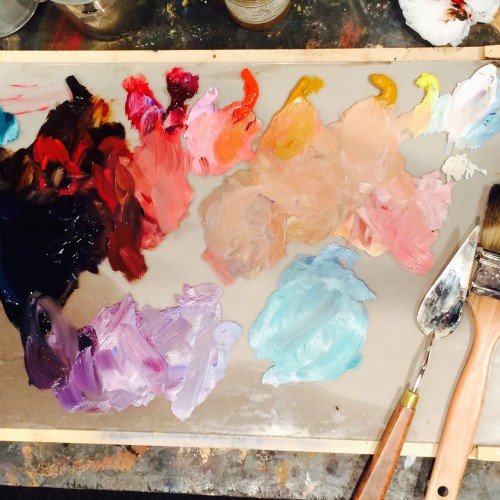
The image size is (500, 500). I want to click on blue paint, so click(304, 336).